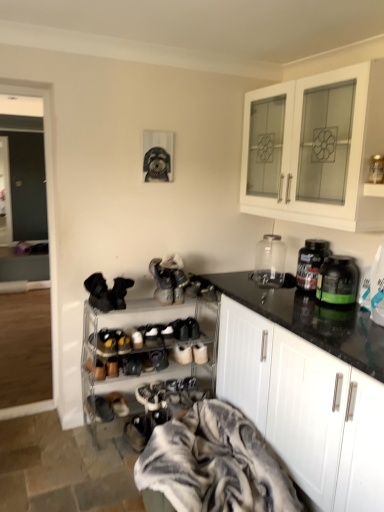
What do you see at coordinates (118, 404) in the screenshot?
I see `brown suede shoes at lower center, marked as the fourth footwear in a right-to-left arrangement` at bounding box center [118, 404].

How much space does brown suede shoes at lower center, marked as the fourth footwear in a right-to-left arrangement, occupy horizontally?

brown suede shoes at lower center, marked as the fourth footwear in a right-to-left arrangement, is 9.75 inches in width.

Where is `black suede shoes at center, positioned as the 1th footwear in top-to-bottom order`? This screenshot has width=384, height=512. black suede shoes at center, positioned as the 1th footwear in top-to-bottom order is located at coordinates (200, 288).

Image resolution: width=384 pixels, height=512 pixels. Describe the element at coordinates (112, 367) in the screenshot. I see `black suede shoe at lower center, which ranks as the 5th shoe in top-to-bottom order` at that location.

Describe the element at coordinates (193, 328) in the screenshot. I see `black matte shoe at center, the 5th shoe from the bottom` at that location.

What is the approximate width of black matte shoe at center, the 5th shoe from the bottom?

6.05 inches.

The width and height of the screenshot is (384, 512). I want to click on brown suede shoes at lower center, acting as the 3th footwear starting from the top, so click(x=118, y=404).

Are black suede shoe at lower center, which appears as the second shoe when ordered from the bottom, and black suede shoes at lower center, marked as the 1th footwear in a bottom-to-top arrangement, located far from each other?

That's not correct — black suede shoe at lower center, which appears as the second shoe when ordered from the bottom, is a little close to black suede shoes at lower center, marked as the 1th footwear in a bottom-to-top arrangement.

Could you measure the distance between black suede shoe at lower center, which ranks as the 5th shoe in top-to-bottom order, and black suede shoes at lower center, acting as the fifth footwear starting from the top?

14.62 inches.

How many degrees apart are the facing directions of black suede shoe at lower center, which ranks as the 5th shoe in top-to-bottom order, and black suede shoes at lower center, marked as the third footwear in a right-to-left arrangement?

0.00212 degrees separate the facing orientations of black suede shoe at lower center, which ranks as the 5th shoe in top-to-bottom order, and black suede shoes at lower center, marked as the third footwear in a right-to-left arrangement.

Is black suede shoe at lower center, which appears as the second shoe when ordered from the bottom, inside the boundaries of black suede shoes at lower center, marked as the third footwear in a right-to-left arrangement, or outside?

black suede shoe at lower center, which appears as the second shoe when ordered from the bottom, is not inside black suede shoes at lower center, marked as the third footwear in a right-to-left arrangement, it's outside.

Does green plastic jar at right, placed as the first bottle when sorted from front to back, have a greater width compared to black suede shoes at center, which is the 1th footwear from right to left?

In fact, green plastic jar at right, placed as the first bottle when sorted from front to back, might be narrower than black suede shoes at center, which is the 1th footwear from right to left.

Is green plastic jar at right, placed as the first bottle when sorted from front to back, behind black suede shoes at center, which is the 1th footwear from right to left?

That is False.

Measure the distance between green plastic jar at right, placed as the first bottle when sorted from front to back, and black suede shoes at center, the 5th footwear from the bottom.

green plastic jar at right, placed as the first bottle when sorted from front to back, is 28.12 inches from black suede shoes at center, the 5th footwear from the bottom.

Who is shorter, green plastic jar at right, the second bottle from the back, or black suede shoes at center, which appears as the fifth footwear when viewed from the left?

With less height is black suede shoes at center, which appears as the fifth footwear when viewed from the left.

Is point (158, 402) positioned before point (119, 298)?

No, it is not.

Which object is closer to the camera taking this photo, white suede shoe at lower center, the 6th shoe from the top, or black suede shoe at center, which is the 1th shoe in top-to-bottom order?

Positioned in front is black suede shoe at center, which is the 1th shoe in top-to-bottom order.

Considering the sizes of objects white suede shoe at lower center, which is counted as the first shoe, starting from the bottom, and black suede shoe at center, which appears as the sixth shoe when ordered from the bottom, in the image provided, who is smaller, white suede shoe at lower center, which is counted as the first shoe, starting from the bottom, or black suede shoe at center, which appears as the sixth shoe when ordered from the bottom,?

Smaller between the two is white suede shoe at lower center, which is counted as the first shoe, starting from the bottom.

Is white suede shoe at lower center, the 6th shoe from the top, turned away from black suede shoe at center, which appears as the sixth shoe when ordered from the bottom?

white suede shoe at lower center, the 6th shoe from the top, does not have its back to black suede shoe at center, which appears as the sixth shoe when ordered from the bottom.

From the image's perspective, is leather shoe at center, positioned as the fourth shoe in top-to-bottom order, under white glossy cabinet at upper right, which ranks as the 2th cabinetry in bottom-to-top order?

Yes.

Considering the sizes of leather shoe at center, which appears as the 3th shoe when ordered from the bottom, and white glossy cabinet at upper right, which appears as the first cabinetry when viewed from the top, in the image, is leather shoe at center, which appears as the 3th shoe when ordered from the bottom, bigger or smaller than white glossy cabinet at upper right, which appears as the first cabinetry when viewed from the top,?

In the image, leather shoe at center, which appears as the 3th shoe when ordered from the bottom, appears to be smaller than white glossy cabinet at upper right, which appears as the first cabinetry when viewed from the top.

Is leather shoe at center, positioned as the fourth shoe in top-to-bottom order, wider or thinner than white glossy cabinet at upper right, which appears as the first cabinetry when viewed from the top?

Considering their sizes, leather shoe at center, positioned as the fourth shoe in top-to-bottom order, looks slimmer than white glossy cabinet at upper right, which appears as the first cabinetry when viewed from the top.

Considering the points (103, 377) and (276, 200), which point is in front, point (103, 377) or point (276, 200)?

Positioned in front is point (276, 200).

Is brown suede shoes at lower center, marked as the fourth footwear in a right-to-left arrangement, in front of or behind white suede shoe at lower center, the 6th shoe from the top, in the image?

Visually, brown suede shoes at lower center, marked as the fourth footwear in a right-to-left arrangement, is located in front of white suede shoe at lower center, the 6th shoe from the top.

From the image's perspective, is brown suede shoes at lower center, acting as the 3th footwear starting from the top, located above or below white suede shoe at lower center, the 6th shoe from the top?

Clearly, from the image's perspective, brown suede shoes at lower center, acting as the 3th footwear starting from the top, is below white suede shoe at lower center, the 6th shoe from the top.

Would you say brown suede shoes at lower center, marked as the fourth footwear in a right-to-left arrangement, contains white suede shoe at lower center, which is counted as the first shoe, starting from the bottom?

No, white suede shoe at lower center, which is counted as the first shoe, starting from the bottom, is not inside brown suede shoes at lower center, marked as the fourth footwear in a right-to-left arrangement.

From the picture: Is brown suede shoes at lower center, acting as the 3th footwear starting from the top, next to white suede shoe at lower center, the 6th shoe from the top?

No.

Visually, is fluffy gray blanket at lower center positioned to the left or to the right of brown suede shoes at lower center, marked as the fourth footwear in a right-to-left arrangement?

fluffy gray blanket at lower center is positioned on brown suede shoes at lower center, marked as the fourth footwear in a right-to-left arrangement,'s right side.

Which object is further away from the camera, fluffy gray blanket at lower center or brown suede shoes at lower center, acting as the 3th footwear starting from the top?

Positioned behind is brown suede shoes at lower center, acting as the 3th footwear starting from the top.

Is fluffy gray blanket at lower center aimed at brown suede shoes at lower center, which is counted as the 3th footwear, starting from the bottom?

No, fluffy gray blanket at lower center is not facing towards brown suede shoes at lower center, which is counted as the 3th footwear, starting from the bottom.

How distant is fluffy gray blanket at lower center from brown suede shoes at lower center, marked as the fourth footwear in a right-to-left arrangement?

fluffy gray blanket at lower center is 28.19 inches away from brown suede shoes at lower center, marked as the fourth footwear in a right-to-left arrangement.

Considering the positions of objects white matte cabinet at right, the 2th cabinetry positioned from the top, and metallic silver shoe rack at lower center in the image provided, who is more to the right, white matte cabinet at right, the 2th cabinetry positioned from the top, or metallic silver shoe rack at lower center?

white matte cabinet at right, the 2th cabinetry positioned from the top.

From the image's perspective, relative to metallic silver shoe rack at lower center, is white matte cabinet at right, which is the 1th cabinetry from bottom to top, above or below?

white matte cabinet at right, which is the 1th cabinetry from bottom to top, is situated lower than metallic silver shoe rack at lower center in the image.

Is white matte cabinet at right, the 2th cabinetry positioned from the top, positioned in front of metallic silver shoe rack at lower center?

Yes, the depth of white matte cabinet at right, the 2th cabinetry positioned from the top, is less than that of metallic silver shoe rack at lower center.

The height and width of the screenshot is (512, 384). I want to click on the 1st shoe behind the black suede shoes at lower center, marked as the third footwear in a right-to-left arrangement, counting from the anchor's position, so click(x=112, y=367).

From a real-world perspective, count 1st footwears downward from the green plastic jar at right, the second bottle from the back, and point to it. Please provide its 2D coordinates.

[(200, 288)]

Estimate the real-world distances between objects in this image. Which object is closer to fluffy gray blanket at lower center, leather shoe at center, positioned as the fourth shoe in top-to-bottom order, or shiny black shoe at center, positioned as the third shoe in top-to-bottom order?

shiny black shoe at center, positioned as the third shoe in top-to-bottom order.

From the image, which object appears to be farther from black suede shoe at center, which is the 1th shoe in top-to-bottom order, green plastic jar at right, placed as the first bottle when sorted from front to back, or metallic silver shoe rack at lower center?

green plastic jar at right, placed as the first bottle when sorted from front to back, is further to black suede shoe at center, which is the 1th shoe in top-to-bottom order.

Based on their spatial positions, is translucent plastic bottle at right, the 2th bottle viewed from the front, or black suede shoe at lower center, which appears as the second shoe when ordered from the bottom, closer to leather shoe at center, which appears as the 3th shoe when ordered from the bottom?

Among the two, black suede shoe at lower center, which appears as the second shoe when ordered from the bottom, is located nearer to leather shoe at center, which appears as the 3th shoe when ordered from the bottom.

Estimate the real-world distances between objects in this image. Which object is further from metallic silver shoe rack at lower center, white suede shoe at lower center, which is counted as the first shoe, starting from the bottom, or white matte cabinet at right, which is the 1th cabinetry from bottom to top?

Based on the image, white matte cabinet at right, which is the 1th cabinetry from bottom to top, appears to be further to metallic silver shoe rack at lower center.

When comparing their distances from black suede shoes at lower center, marked as the third footwear in a right-to-left arrangement, does white matte cabinet at right, the 2th cabinetry positioned from the top, or leather sneaker at lower left, marked as the fifth footwear in a right-to-left arrangement, seem closer?

Based on the image, leather sneaker at lower left, marked as the fifth footwear in a right-to-left arrangement, appears to be nearer to black suede shoes at lower center, marked as the third footwear in a right-to-left arrangement.

Considering their positions, is black suede shoe at center, which is the 1th shoe in top-to-bottom order, positioned closer to leather shoe at center, which appears as the 3th shoe when ordered from the bottom, than fluffy gray blanket at lower center?

Based on the image, black suede shoe at center, which is the 1th shoe in top-to-bottom order, appears to be nearer to leather shoe at center, which appears as the 3th shoe when ordered from the bottom.

Consider the image. Looking at the image, which one is located closer to white suede sneakers at center, the 2th footwear positioned from the right, leather sneaker at lower left, which is the 2th footwear from bottom to top, or black suede shoe at center, which appears as the sixth shoe when ordered from the bottom?

Based on the image, leather sneaker at lower left, which is the 2th footwear from bottom to top, appears to be nearer to white suede sneakers at center, the 2th footwear positioned from the right.

Looking at the image, which one is located closer to translucent plastic bottle at right, positioned as the first bottle in back-to-front order, white glossy cabinet at upper right, which ranks as the 2th cabinetry in bottom-to-top order, or black suede shoe at center, which appears as the sixth shoe when ordered from the bottom?

Among the two, white glossy cabinet at upper right, which ranks as the 2th cabinetry in bottom-to-top order, is located nearer to translucent plastic bottle at right, positioned as the first bottle in back-to-front order.

Identify the location of bottle situated between leather shoe at center, positioned as the fourth shoe in top-to-bottom order, and green plastic jar at right, placed as the first bottle when sorted from front to back, from left to right. This screenshot has height=512, width=384. (311, 263).

Image resolution: width=384 pixels, height=512 pixels. I want to click on shelf between black suede shoe at lower center, which appears as the second shoe when ordered from the bottom, and white suede sneakers at center, the 2th footwear positioned from the right, from left to right, so coord(145,354).

What are the coordinates of `footwear between white glossy cabinet at upper right, which ranks as the 2th cabinetry in bottom-to-top order, and black matte shoe at center, the 5th shoe from the bottom, in the vertical direction` in the screenshot? It's located at (200, 288).

Find the location of `bottle situated between brown suede shoes at lower center, which is counted as the 3th footwear, starting from the bottom, and green plastic jar at right, placed as the first bottle when sorted from front to back, from left to right`. bottle situated between brown suede shoes at lower center, which is counted as the 3th footwear, starting from the bottom, and green plastic jar at right, placed as the first bottle when sorted from front to back, from left to right is located at coordinates (311, 263).